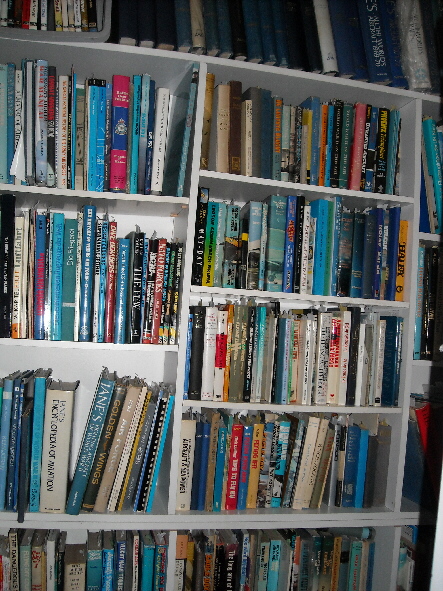
Locate an element on the screen. The image size is (443, 591). book with pink and blue spine is located at coordinates (122, 112).